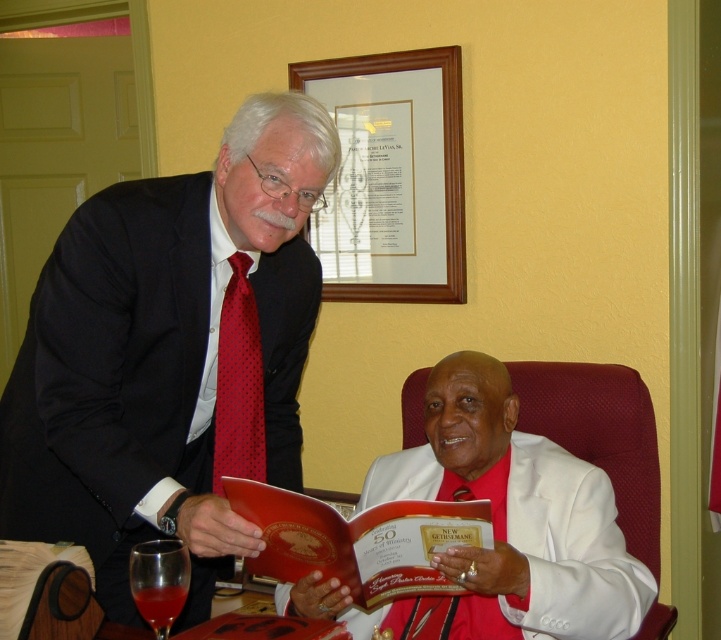
Question: Is white satin suit at center thinner than wooden picture frame at upper center?

Choices:
 (A) yes
 (B) no

Answer: (B)

Question: Is matte black suit at left bigger than wooden picture frame at upper center?

Choices:
 (A) no
 (B) yes

Answer: (B)

Question: Is matte red book at center positioned at the back of red dotted tie at left?

Choices:
 (A) no
 (B) yes

Answer: (A)

Question: Which point is closer to the camera?

Choices:
 (A) matte black suit at left
 (B) red dotted tie at left
 (C) wooden picture frame at upper center

Answer: (A)

Question: Which object is closer to the camera taking this photo?

Choices:
 (A) transparent glass at lower left
 (B) matte red book at center

Answer: (A)

Question: Which object is farther from the camera taking this photo?

Choices:
 (A) red dotted tie at left
 (B) wooden picture frame at upper center

Answer: (B)